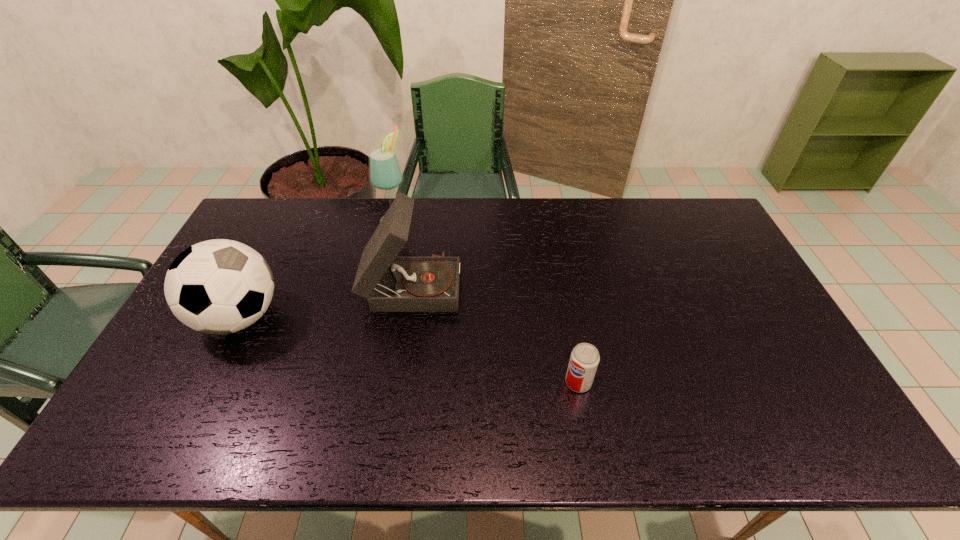
Where is `empty space between the farthest object and the rightmost object`? The image size is (960, 540). empty space between the farthest object and the rightmost object is located at coordinates (487, 301).

I want to click on free space between the tallest object and the leftmost object, so click(317, 268).

Find the location of `vacant region between the second shortest object and the alcohol`. vacant region between the second shortest object and the alcohol is located at coordinates (317, 268).

Image resolution: width=960 pixels, height=540 pixels. What are the coordinates of `free point between the phonograph_record and the soda` in the screenshot? It's located at (495, 333).

Find the location of a particular element. Image resolution: width=960 pixels, height=540 pixels. free space between the rightmost object and the phonograph_record is located at coordinates (495, 333).

Find the location of a particular element. The image size is (960, 540). vacant region between the soccer ball and the soda is located at coordinates (409, 350).

Locate which object ranks in proximity to the phonograph_record. Please provide its 2D coordinates. Your answer should be formatted as a tuple, i.e. [(x, y)], where the tuple contains the x and y coordinates of a point satisfying the conditions above.

[(385, 173)]

Identify which object is located as the nearest to the leftmost object. Please provide its 2D coordinates. Your answer should be formatted as a tuple, i.e. [(x, y)], where the tuple contains the x and y coordinates of a point satisfying the conditions above.

[(390, 284)]

The width and height of the screenshot is (960, 540). What are the coordinates of `vacant space that satisfies the following two spatial constraints: 1. on the back side of the rightmost object; 2. on the front-facing side of the phonograph_record` in the screenshot? It's located at (561, 284).

Where is `vacant space that satisfies the following two spatial constraints: 1. on the main logo of the soda; 2. on the left side of the second shortest object`? Image resolution: width=960 pixels, height=540 pixels. vacant space that satisfies the following two spatial constraints: 1. on the main logo of the soda; 2. on the left side of the second shortest object is located at coordinates (207, 382).